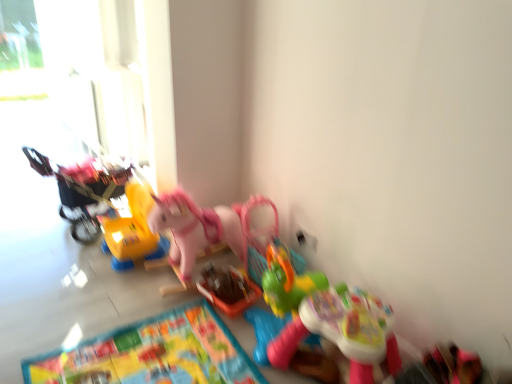
Image resolution: width=512 pixels, height=384 pixels. I want to click on multicolored fabric mat at lower center, so click(x=153, y=354).

Measure the distance between pink plastic rocking horse at center, the 4th toy in the left-to-right sequence, and camera.

pink plastic rocking horse at center, the 4th toy in the left-to-right sequence, is 2.22 meters away from camera.

Find the location of a particular element. This screenshot has width=512, height=384. yellow plastic toy at center-left, which is the 2th toy from left to right is located at coordinates (132, 230).

Is pink plastic rocking horse at center, the 3th toy when ordered from left to right, to the left of plastic basket at center, arranged as the fifth toy when viewed from the left, from the viewer's perspective?

Indeed, pink plastic rocking horse at center, the 3th toy when ordered from left to right, is positioned on the left side of plastic basket at center, arranged as the fifth toy when viewed from the left.

How distant is pink plastic rocking horse at center, the 3th toy when ordered from left to right, from plastic basket at center, arranged as the fifth toy when viewed from the left?

pink plastic rocking horse at center, the 3th toy when ordered from left to right, is 14.03 inches from plastic basket at center, arranged as the fifth toy when viewed from the left.

Considering the relative sizes of pink plastic rocking horse at center, the 3th toy when ordered from left to right, and plastic basket at center, arranged as the fifth toy when viewed from the left, in the image provided, is pink plastic rocking horse at center, the 3th toy when ordered from left to right, shorter than plastic basket at center, arranged as the fifth toy when viewed from the left,?

Correct, pink plastic rocking horse at center, the 3th toy when ordered from left to right, is not as tall as plastic basket at center, arranged as the fifth toy when viewed from the left.

Is point (157, 225) farther from camera compared to point (246, 305)?

Yes, point (157, 225) is farther from viewer.

Which object is further away from the camera taking this photo, yellow plastic toy car at left, the 6th toy from the right, or pink plastic rocking horse at center, positioned as the fourth toy in right-to-left order?

yellow plastic toy car at left, the 6th toy from the right, is behind.

Is yellow plastic toy car at left, the 6th toy from the right, far from pink plastic rocking horse at center, positioned as the fourth toy in right-to-left order?

Actually, yellow plastic toy car at left, the 6th toy from the right, and pink plastic rocking horse at center, positioned as the fourth toy in right-to-left order, are a little close together.

Is yellow plastic toy car at left, the 6th toy from the right, facing away from pink plastic rocking horse at center, positioned as the fourth toy in right-to-left order?

No, pink plastic rocking horse at center, positioned as the fourth toy in right-to-left order, is not at the back of yellow plastic toy car at left, the 6th toy from the right.

From a real-world perspective, is yellow plastic toy car at left, the 6th toy from the right, over pink plastic rocking horse at center, positioned as the fourth toy in right-to-left order?

Yes, from a real-world perspective, yellow plastic toy car at left, the 6th toy from the right, is over pink plastic rocking horse at center, positioned as the fourth toy in right-to-left order

From a real-world perspective, who is located lower, multicolored fabric mat at lower center or pink plastic rocking horse at center, positioned as the fourth toy in right-to-left order?

In real-world perspective, pink plastic rocking horse at center, positioned as the fourth toy in right-to-left order, is lower.

Considering the relative positions of multicolored fabric mat at lower center and pink plastic rocking horse at center, positioned as the fourth toy in right-to-left order, in the image provided, is multicolored fabric mat at lower center behind pink plastic rocking horse at center, positioned as the fourth toy in right-to-left order,?

Yes, it is.

Is multicolored fabric mat at lower center completely or partially outside of pink plastic rocking horse at center, the 3th toy when ordered from left to right?

No, multicolored fabric mat at lower center is not outside of pink plastic rocking horse at center, the 3th toy when ordered from left to right.

Does point (195, 382) come in front of point (265, 347)?

Yes.

From a real-world perspective, is plastic colorful walker at lower right, acting as the 1th toy starting from the right, above or below yellow plastic toy car at left, acting as the 1th toy starting from the left?

plastic colorful walker at lower right, acting as the 1th toy starting from the right, is below yellow plastic toy car at left, acting as the 1th toy starting from the left.

What's the angular difference between plastic colorful walker at lower right, acting as the 1th toy starting from the right, and yellow plastic toy car at left, the 6th toy from the right,'s facing directions?

The angular difference between plastic colorful walker at lower right, acting as the 1th toy starting from the right, and yellow plastic toy car at left, the 6th toy from the right, is 0.815 degrees.

The width and height of the screenshot is (512, 384). I want to click on the 4th toy below the yellow plastic toy car at left, the 6th toy from the right (from the image's perspective), so click(342, 331).

Based on their sizes in the image, would you say plastic colorful walker at lower right, the 6th toy in the left-to-right sequence, is bigger or smaller than yellow plastic toy car at left, the 6th toy from the right?

Clearly, plastic colorful walker at lower right, the 6th toy in the left-to-right sequence, is smaller in size than yellow plastic toy car at left, the 6th toy from the right.

Would you say yellow plastic toy car at left, acting as the 1th toy starting from the left, is to the left or to the right of plastic colorful walker at lower right, acting as the 1th toy starting from the right, in the picture?

Based on their positions, yellow plastic toy car at left, acting as the 1th toy starting from the left, is located to the left of plastic colorful walker at lower right, acting as the 1th toy starting from the right.

Which point is more forward, (x=71, y=195) or (x=368, y=354)?

The point (x=368, y=354) is closer.

Is yellow plastic toy car at left, the 6th toy from the right, facing away from plastic colorful walker at lower right, acting as the 1th toy starting from the right?

No, yellow plastic toy car at left, the 6th toy from the right, is not facing the opposite direction of plastic colorful walker at lower right, acting as the 1th toy starting from the right.

Is yellow plastic toy car at left, acting as the 1th toy starting from the left, directly adjacent to plastic colorful walker at lower right, acting as the 1th toy starting from the right?

No, yellow plastic toy car at left, acting as the 1th toy starting from the left, is not beside plastic colorful walker at lower right, acting as the 1th toy starting from the right.

From the image's perspective, starting from the pink plastic rocking horse at center, positioned as the fourth toy in right-to-left order, which toy is the 2nd one above? Please provide its 2D coordinates.

[(227, 289)]

Is point (250, 295) more distant than point (313, 334)?

Yes, it is behind point (313, 334).

Which of these two, plastic basket at center, arranged as the fifth toy when viewed from the left, or pink plastic rocking horse at center, the 3th toy when ordered from left to right, is wider?

pink plastic rocking horse at center, the 3th toy when ordered from left to right.

From a real-world perspective, is plastic basket at center, arranged as the fifth toy when viewed from the left, physically below pink plastic rocking horse at center, positioned as the fourth toy in right-to-left order?

No.

Could you tell me if pink plastic rocking horse at center, the 4th toy in the left-to-right sequence, is facing multicolored fabric mat at lower center?

No, pink plastic rocking horse at center, the 4th toy in the left-to-right sequence, is not aimed at multicolored fabric mat at lower center.

Is pink plastic rocking horse at center, the third toy in the right-to-left sequence, touching multicolored fabric mat at lower center?

They are not placed beside each other.

From a real-world perspective, who is located lower, pink plastic rocking horse at center, the 4th toy in the left-to-right sequence, or multicolored fabric mat at lower center?

multicolored fabric mat at lower center.

Is pink plastic rocking horse at center, the 4th toy in the left-to-right sequence, shorter than multicolored fabric mat at lower center?

Incorrect, the height of pink plastic rocking horse at center, the 4th toy in the left-to-right sequence, does not fall short of that of multicolored fabric mat at lower center.

Where is `the 2nd toy counting from the right of the pink plastic rocking horse at center, the 3th toy when ordered from left to right`? This screenshot has height=384, width=512. the 2nd toy counting from the right of the pink plastic rocking horse at center, the 3th toy when ordered from left to right is located at coordinates (x=227, y=289).

The height and width of the screenshot is (384, 512). Identify the location of the 5th toy positioned below the yellow plastic toy car at left, the 6th toy from the right (from the image's perspective). (237, 255).

Considering their positions, is multicolored fabric mat at lower center positioned closer to plastic colorful walker at lower right, acting as the 1th toy starting from the right, than plastic basket at center, the 2th toy positioned from the right?

multicolored fabric mat at lower center is closer to plastic colorful walker at lower right, acting as the 1th toy starting from the right.

From the image, which object appears to be farther from pink plastic rocking horse at center, the 3th toy when ordered from left to right, yellow plastic toy at center-left, which ranks as the 5th toy in right-to-left order, or plastic colorful walker at lower right, the 6th toy in the left-to-right sequence?

Based on the image, yellow plastic toy at center-left, which ranks as the 5th toy in right-to-left order, appears to be further to pink plastic rocking horse at center, the 3th toy when ordered from left to right.

Estimate the real-world distances between objects in this image. Which object is closer to plastic colorful walker at lower right, the 6th toy in the left-to-right sequence, pink plastic rocking horse at center, the third toy in the right-to-left sequence, or yellow plastic toy car at left, the 6th toy from the right?

pink plastic rocking horse at center, the third toy in the right-to-left sequence, is positioned closer to the anchor plastic colorful walker at lower right, the 6th toy in the left-to-right sequence.

Considering their positions, is pink plastic rocking horse at center, the 3th toy when ordered from left to right, positioned closer to yellow plastic toy at center-left, which ranks as the 5th toy in right-to-left order, than multicolored fabric mat at lower center?

pink plastic rocking horse at center, the 3th toy when ordered from left to right, is positioned closer to the anchor yellow plastic toy at center-left, which ranks as the 5th toy in right-to-left order.

Which object lies nearer to the anchor point multicolored fabric mat at lower center, yellow plastic toy at center-left, which is the 2th toy from left to right, or plastic colorful walker at lower right, the 6th toy in the left-to-right sequence?

Based on the image, plastic colorful walker at lower right, the 6th toy in the left-to-right sequence, appears to be nearer to multicolored fabric mat at lower center.

Based on their spatial positions, is yellow plastic toy at center-left, which is the 2th toy from left to right, or pink plastic rocking horse at center, the third toy in the right-to-left sequence, closer to yellow plastic toy car at left, the 6th toy from the right?

yellow plastic toy at center-left, which is the 2th toy from left to right, is closer to yellow plastic toy car at left, the 6th toy from the right.

Based on their spatial positions, is yellow plastic toy car at left, the 6th toy from the right, or pink plastic rocking horse at center, positioned as the fourth toy in right-to-left order, further from multicolored fabric mat at lower center?

yellow plastic toy car at left, the 6th toy from the right, is further to multicolored fabric mat at lower center.

Which object lies nearer to the anchor point yellow plastic toy at center-left, which is the 2th toy from left to right, multicolored fabric mat at lower center or yellow plastic toy car at left, acting as the 1th toy starting from the left?

yellow plastic toy car at left, acting as the 1th toy starting from the left.

I want to click on mat located between pink plastic rocking horse at center, the 3th toy when ordered from left to right, and yellow plastic toy at center-left, which is the 2th toy from left to right, in the depth direction, so click(153, 354).

The image size is (512, 384). In order to click on mat between pink plastic rocking horse at center, the 3th toy when ordered from left to right, and yellow plastic toy car at left, acting as the 1th toy starting from the left, along the z-axis in this screenshot , I will do `click(153, 354)`.

I want to click on mat between yellow plastic toy car at left, the 6th toy from the right, and plastic colorful walker at lower right, acting as the 1th toy starting from the right, from left to right, so click(x=153, y=354).

You are a GUI agent. You are given a task and a screenshot of the screen. Output one action in this format:
    pyautogui.click(x=<x>, y=<y>)
    Task: Click on the toy between plastic colorful walker at lower right, acting as the 1th toy starting from the right, and plastic basket at center, arranged as the fifth toy when viewed from the left, from front to back
    
    Given the screenshot: What is the action you would take?
    pyautogui.click(x=194, y=228)